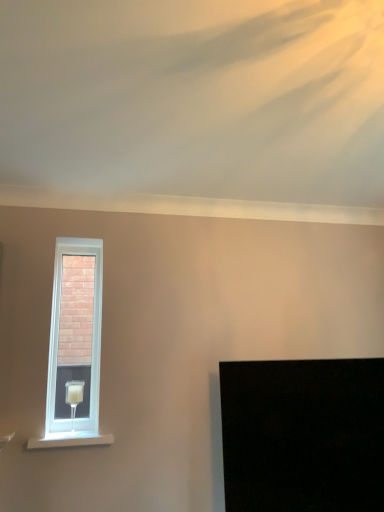
Question: Considering the relative positions of white plastic window at upper left and white painted wood at lower left in the image provided, is white plastic window at upper left to the right of white painted wood at lower left from the viewer's perspective?

Choices:
 (A) yes
 (B) no

Answer: (B)

Question: Is white plastic window at upper left oriented away from white painted wood at lower left?

Choices:
 (A) no
 (B) yes

Answer: (A)

Question: From a real-world perspective, is white plastic window at upper left under white painted wood at lower left?

Choices:
 (A) yes
 (B) no

Answer: (B)

Question: Is white plastic window at upper left not within white painted wood at lower left?

Choices:
 (A) no
 (B) yes

Answer: (B)

Question: Can white painted wood at lower left be found inside white plastic window at upper left?

Choices:
 (A) no
 (B) yes

Answer: (A)

Question: Relative to white plastic window at upper left, is white painted wood at lower left in front or behind?

Choices:
 (A) behind
 (B) front

Answer: (B)

Question: From a real-world perspective, is white painted wood at lower left physically located above or below white plastic window at upper left?

Choices:
 (A) below
 (B) above

Answer: (A)

Question: Looking at the image, does white painted wood at lower left seem bigger or smaller compared to white plastic window at upper left?

Choices:
 (A) small
 (B) big

Answer: (A)

Question: In terms of height, does white painted wood at lower left look taller or shorter compared to white plastic window at upper left?

Choices:
 (A) short
 (B) tall

Answer: (A)

Question: Considering the positions of white plastic window at upper left and white painted wood at lower left in the image, is white plastic window at upper left wider or thinner than white painted wood at lower left?

Choices:
 (A) wide
 (B) thin

Answer: (B)

Question: From a real-world perspective, is white plastic window at upper left above or below white painted wood at lower left?

Choices:
 (A) above
 (B) below

Answer: (A)

Question: Is white plastic window at upper left spatially inside white painted wood at lower left, or outside of it?

Choices:
 (A) inside
 (B) outside

Answer: (B)

Question: Based on their positions, is white plastic window at upper left located to the left or right of white painted wood at lower left?

Choices:
 (A) right
 (B) left

Answer: (B)

Question: Is white plastic window at upper left bigger or smaller than translucent glass table lamp at left?

Choices:
 (A) big
 (B) small

Answer: (A)

Question: Looking at their shapes, would you say white plastic window at upper left is wider or thinner than translucent glass table lamp at left?

Choices:
 (A) thin
 (B) wide

Answer: (A)